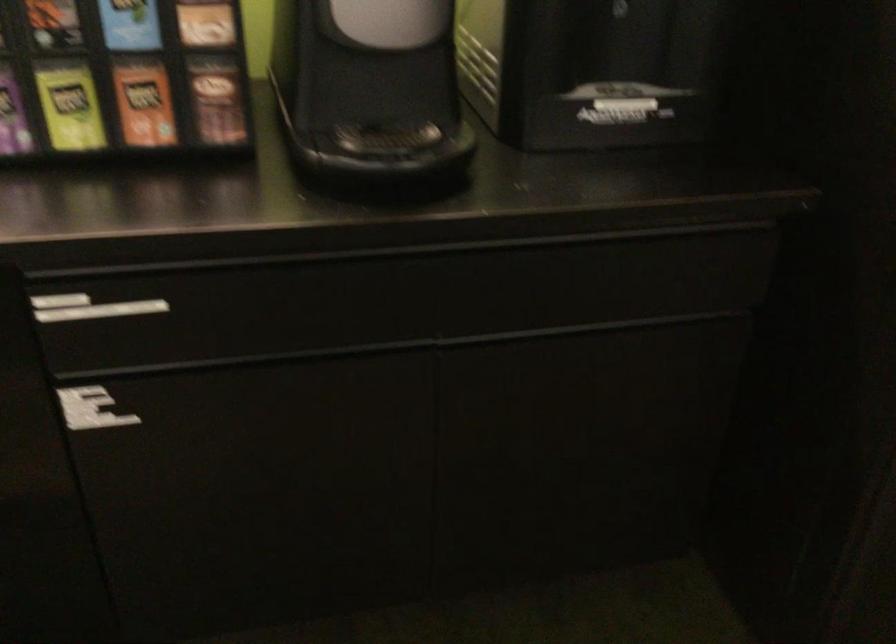
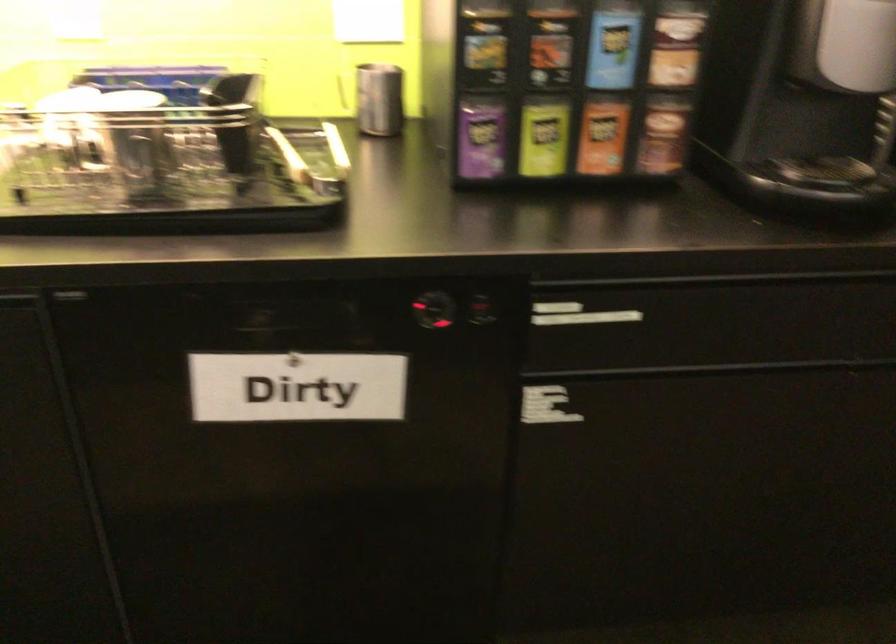
Where in the second image is the point corresponding to point 149,104 from the first image?

(602, 136)